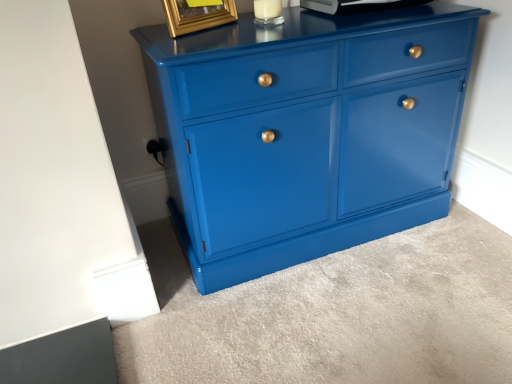
Question: Is metallic silver appliance at upper center bigger or smaller than glossy blue cabinet at center?

Choices:
 (A) small
 (B) big

Answer: (A)

Question: Visually, is metallic silver appliance at upper center positioned to the left or to the right of glossy blue cabinet at center?

Choices:
 (A) left
 (B) right

Answer: (B)

Question: Which object is positioned farthest from the glossy blue cabinet at center?

Choices:
 (A) gold metallic picture frame at upper center
 (B) metallic silver appliance at upper center

Answer: (A)

Question: Estimate the real-world distances between objects in this image. Which object is farther from the glossy blue cabinet at center?

Choices:
 (A) metallic silver appliance at upper center
 (B) gold metallic picture frame at upper center

Answer: (B)